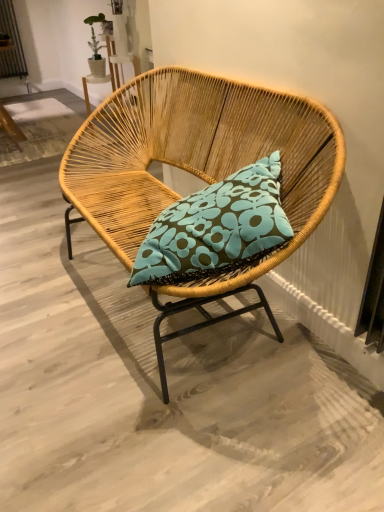
Locate an element on the screen. The image size is (384, 512). vacant space underneath woven wood chair at center (from a real-world perspective) is located at coordinates (182, 322).